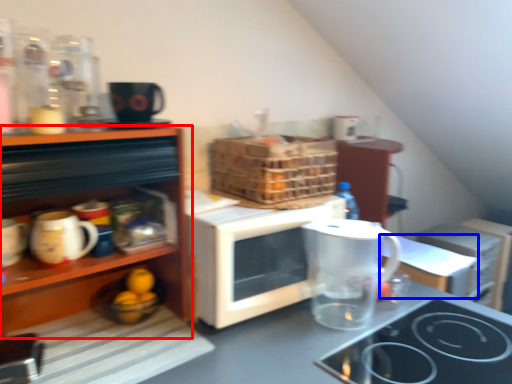
Question: Which object is closer to the camera taking this photo, cabinetry (highlighted by a red box) or table (highlighted by a blue box)?

Choices:
 (A) cabinetry
 (B) table

Answer: (A)